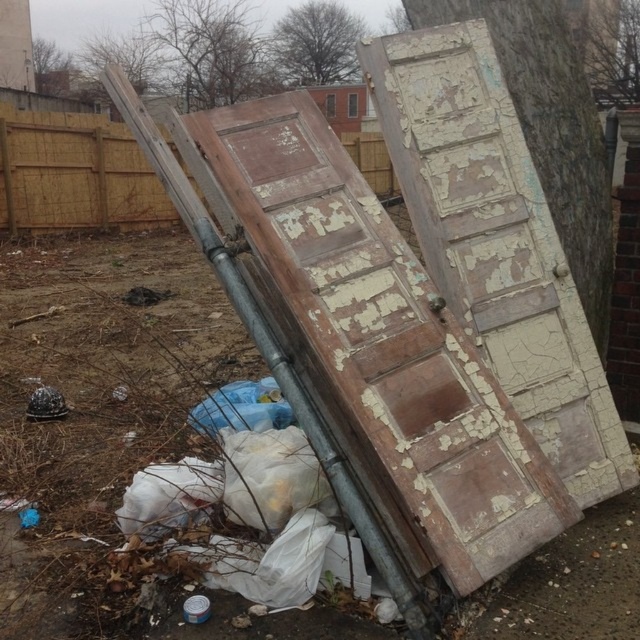
In the scene shown: You are a painter assessing the scene. You need to determine which object requires more attention based on their heights. Which is taller between the peeling paint wood door at center and the wooden fence at upper left?

The peeling paint wood door at center is taller than the wooden fence at upper left, so it requires more attention due to its height.

You are a painter assessing the scene. You see the peeling paint wood door at center and the wooden fence at upper left. Which object is closer to you?

The peeling paint wood door at center is closer to you because it is in front of the wooden fence at upper left.

You are standing at the point marked by the coordinates point (356, 344) in the scene. Looking around, you see two old wooden doors leaning against each other on a metal pipe. Which object are you currently standing on?

The point (356, 344) marks peeling paint wood door at center, so you are standing on the peeling paint wood door at center.